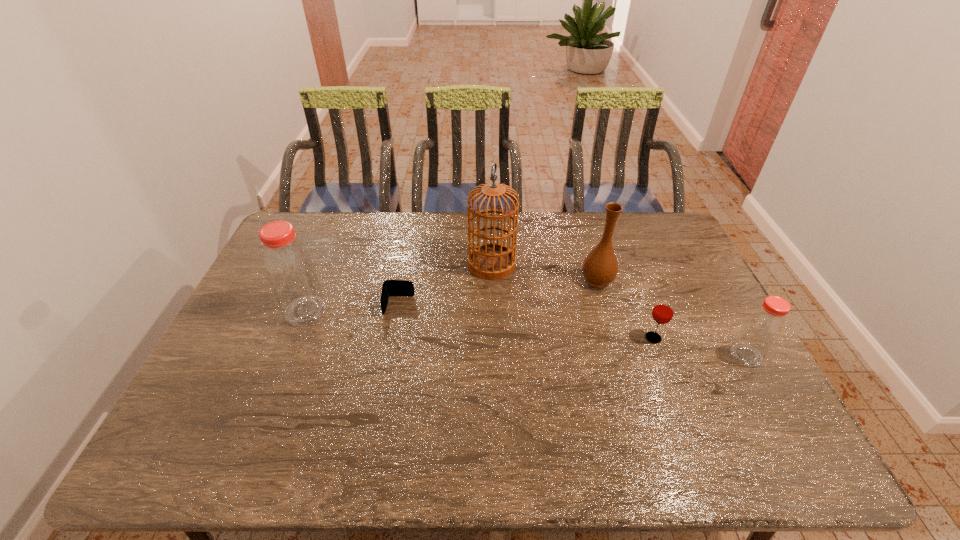
This screenshot has height=540, width=960. Find the location of `free spot between the rightmost object and the tallest object`. free spot between the rightmost object and the tallest object is located at coordinates (619, 309).

Image resolution: width=960 pixels, height=540 pixels. I want to click on free space between the fourth object from right to left and the third object from right to left, so click(x=544, y=272).

Where is `free point between the fourth object from right to left and the second shortest object`? The height and width of the screenshot is (540, 960). free point between the fourth object from right to left and the second shortest object is located at coordinates (572, 301).

Image resolution: width=960 pixels, height=540 pixels. In order to click on blank region between the second object from left to right and the taller bottle in this screenshot , I will do `click(352, 308)`.

Find the location of `vacant space that is in between the nearer bottle and the birdcage`. vacant space that is in between the nearer bottle and the birdcage is located at coordinates (619, 309).

I want to click on vacant area between the vase and the wallet, so click(498, 293).

Choose which object is the third nearest neighbor to the birdcage. Please provide its 2D coordinates. Your answer should be formatted as a tuple, i.e. [(x, y)], where the tuple contains the x and y coordinates of a point satisfying the conditions above.

[(663, 311)]

This screenshot has width=960, height=540. Find the location of `object identified as the fifth closest to the right bottle`. object identified as the fifth closest to the right bottle is located at coordinates (289, 268).

Where is `vacant region that satisfies the following two spatial constraints: 1. on the front side of the second shortest object; 2. on the right side of the rightmost object`? The image size is (960, 540). vacant region that satisfies the following two spatial constraints: 1. on the front side of the second shortest object; 2. on the right side of the rightmost object is located at coordinates (660, 355).

Locate an element on the screen. The width and height of the screenshot is (960, 540). vacant space that satisfies the following two spatial constraints: 1. on the front side of the glass; 2. on the left side of the birdcage is located at coordinates (494, 338).